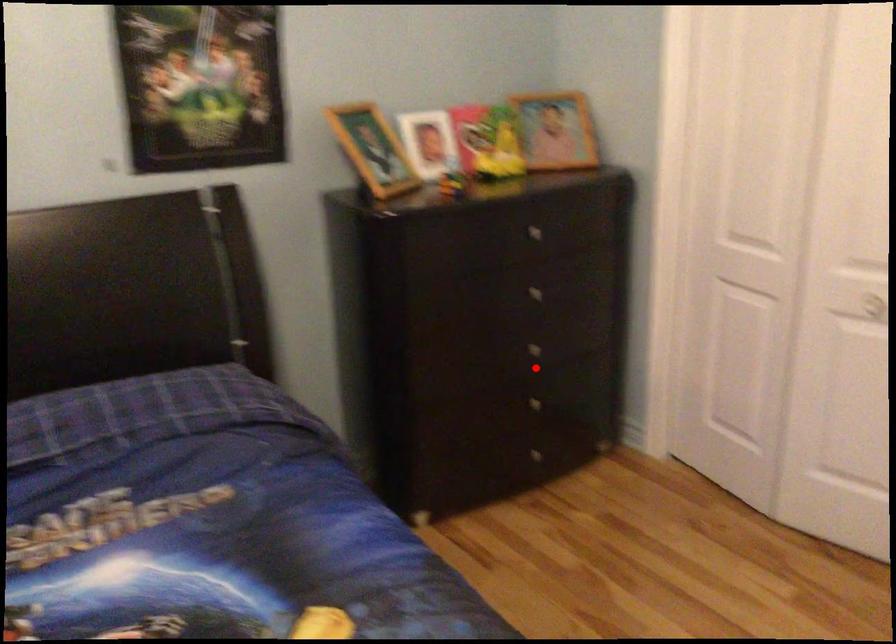
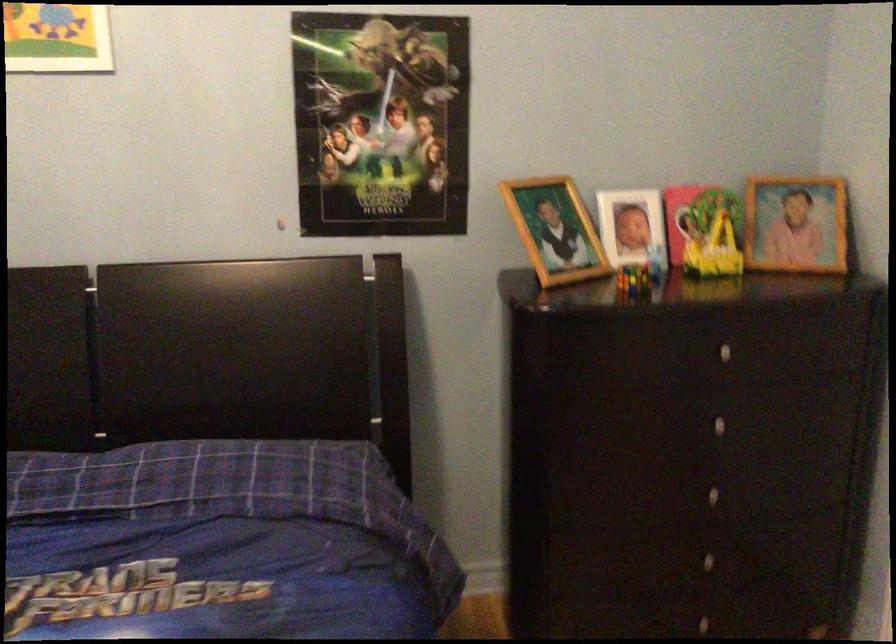
Find the pixel in the second image that matches the highlighted location in the first image.

(711, 516)